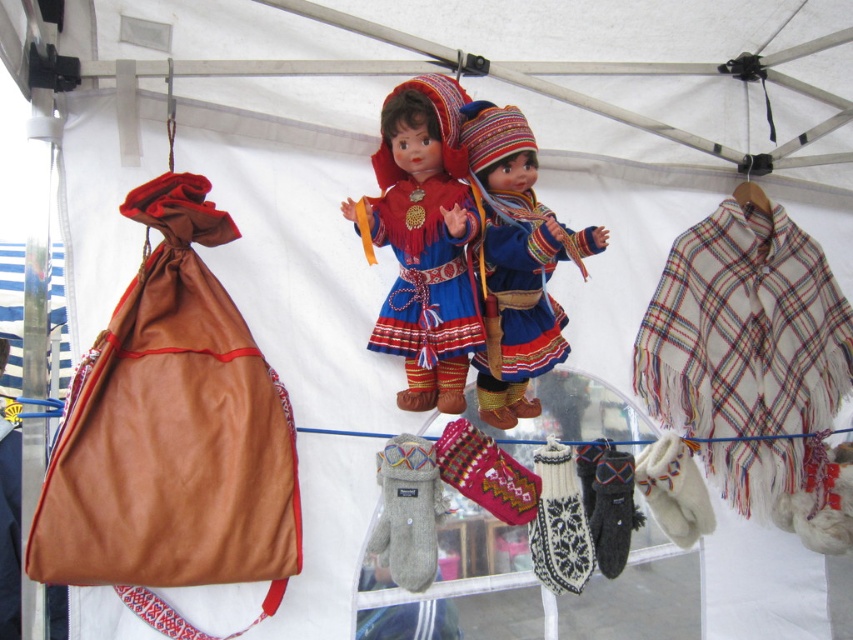
Can you confirm if matte blue fabric dress at center is positioned to the left of gray wool mittens at center?

Incorrect, matte blue fabric dress at center is not on the left side of gray wool mittens at center.

Does point (509, 232) come closer to viewer compared to point (431, 522)?

Yes, point (509, 232) is in front of point (431, 522).

Is point (490, 209) behind point (401, 438)?

No.

The height and width of the screenshot is (640, 853). In order to click on matte blue fabric dress at center in this screenshot , I will do `click(523, 285)`.

Does matte blue fabric doll at center have a lesser height compared to matte blue fabric dress at center?

No, matte blue fabric doll at center is not shorter than matte blue fabric dress at center.

Can you confirm if matte blue fabric doll at center is positioned above matte blue fabric dress at center?

Yes.

Is point (370, 236) less distant than point (527, 252)?

No, (370, 236) is behind (527, 252).

Image resolution: width=853 pixels, height=640 pixels. What are the coordinates of `matte blue fabric doll at center` in the screenshot? It's located at (425, 241).

Locate an element on the screen. Image resolution: width=853 pixels, height=640 pixels. matte blue fabric doll at center is located at coordinates (425, 241).

From the picture: Between matte blue fabric doll at center and gray wool mittens at center, which one is positioned higher?

matte blue fabric doll at center

In order to click on matte blue fabric doll at center in this screenshot , I will do `click(425, 241)`.